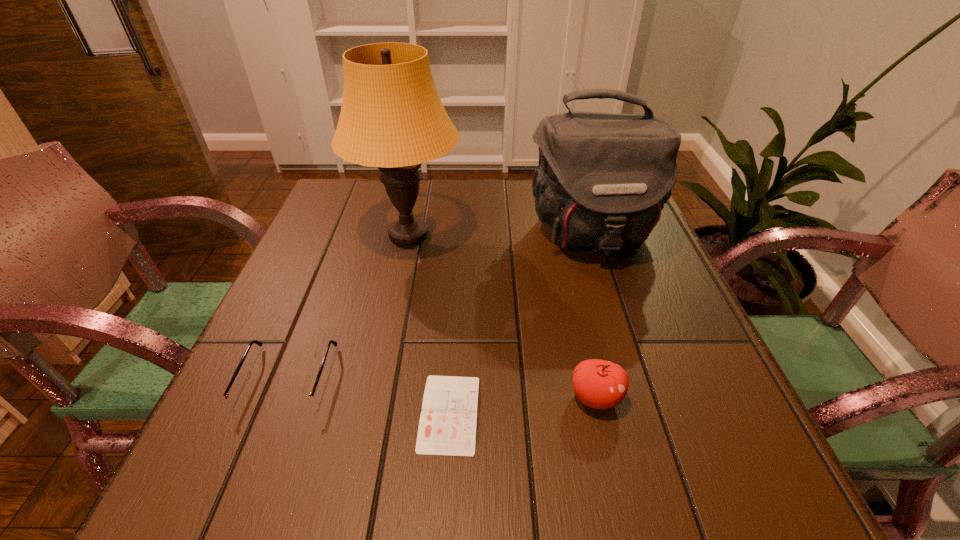
This screenshot has height=540, width=960. I want to click on lampshade, so click(x=391, y=117).

Find the location of `shoulder bag`. shoulder bag is located at coordinates (602, 180).

Identify the location of apple. (599, 384).

Where is `spectacles`? spectacles is located at coordinates (242, 402).

Where is `the shortest object`? The width and height of the screenshot is (960, 540). the shortest object is located at coordinates (447, 426).

This screenshot has height=540, width=960. I want to click on free space located 0.290m on the front of the tallest object, so click(379, 374).

The image size is (960, 540). In order to click on free spot located 0.300m on the open flap of the second tallest object in this screenshot , I will do `click(639, 383)`.

This screenshot has width=960, height=540. What are the coordinates of `free space located 0.070m on the back of the apple` in the screenshot? It's located at (584, 347).

At what (x,y) coordinates should I click in order to perform the action: click on free spot located 0.070m at the hinge ends of the fourth tallest object. Please return your answer as a coordinate pair (x, y). The image size is (960, 540). Looking at the image, I should click on (257, 457).

You are a GUI agent. You are given a task and a screenshot of the screen. Output one action in this format:
    pyautogui.click(x=<x>, y=<y>)
    Task: Click on the vacant space located 0.250m on the right of the shortest object
    Image resolution: width=960 pixels, height=540 pixels.
    Given the screenshot: What is the action you would take?
    pyautogui.click(x=632, y=413)